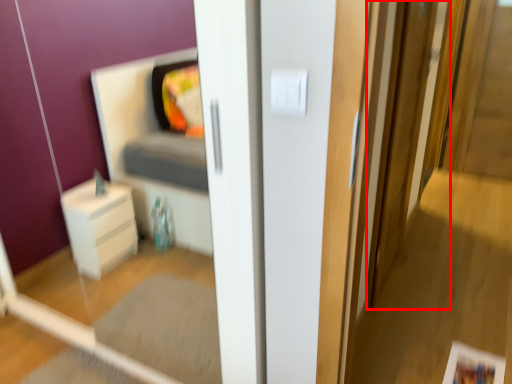
Question: Where is screen door (annotated by the red box) located in relation to light switch in the image?

Choices:
 (A) left
 (B) right

Answer: (B)